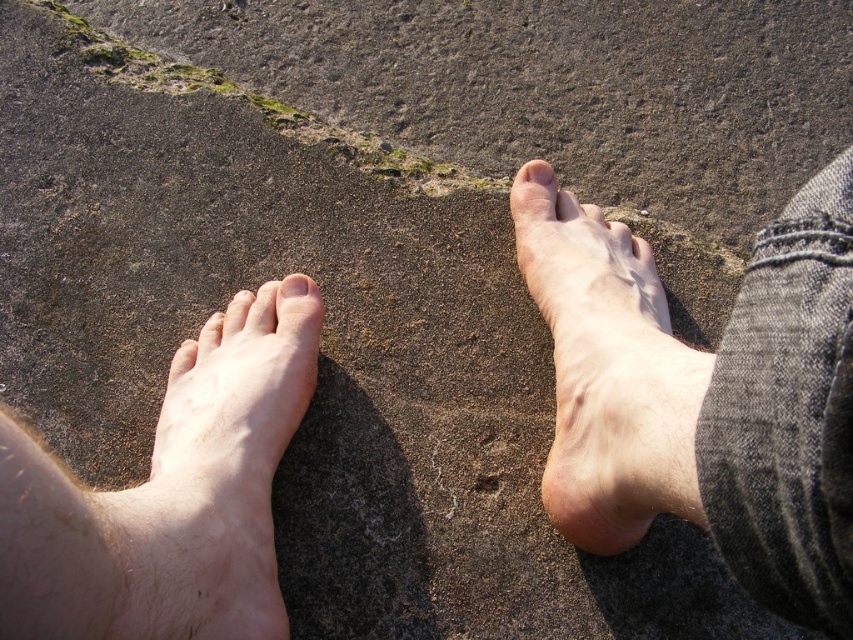
Question: Can you confirm if skinny barefoot at right is positioned above pale skin foot at lower left?

Choices:
 (A) yes
 (B) no

Answer: (A)

Question: Is pale skin/soft flesh at center thinner than matte skin toe at upper center?

Choices:
 (A) no
 (B) yes

Answer: (A)

Question: Based on their relative distances, which object is nearer to the pale skin toe at center?

Choices:
 (A) pale skin/soft flesh at center
 (B) skinny barefoot at right

Answer: (A)

Question: Which point is farther from the camera taking this photo?

Choices:
 (A) (111, 508)
 (B) (305, 291)
 (C) (778, 557)
 (D) (550, 172)

Answer: (D)

Question: Among these objects, which one is farthest from the camera?

Choices:
 (A) pale skin foot at lower left
 (B) matte skin toe at upper center
 (C) pale skin/soft flesh at center

Answer: (B)

Question: Can you confirm if pale skin/soft flesh at center is wider than matte skin toe at upper center?

Choices:
 (A) yes
 (B) no

Answer: (A)